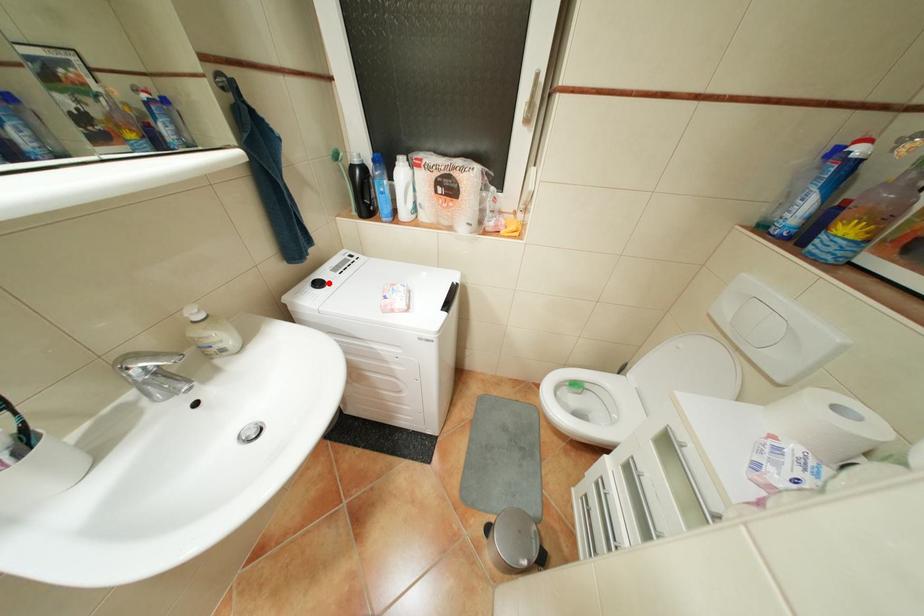
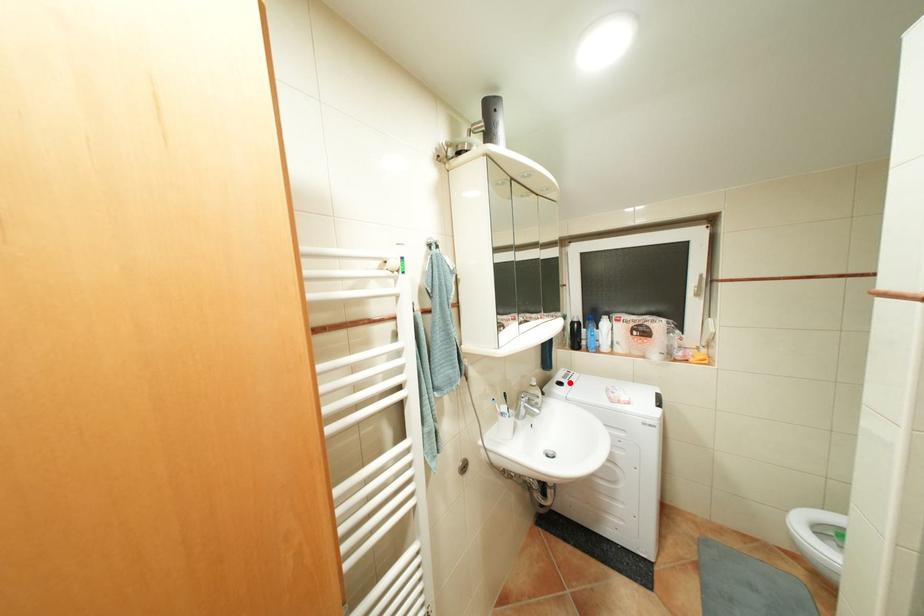
I am providing you with two images of the same scene from different viewpoints. A red point is marked on the first image and another point is marked on the second image. Does the point marked in image1 correspond to the same location as the one in image2?

Yes